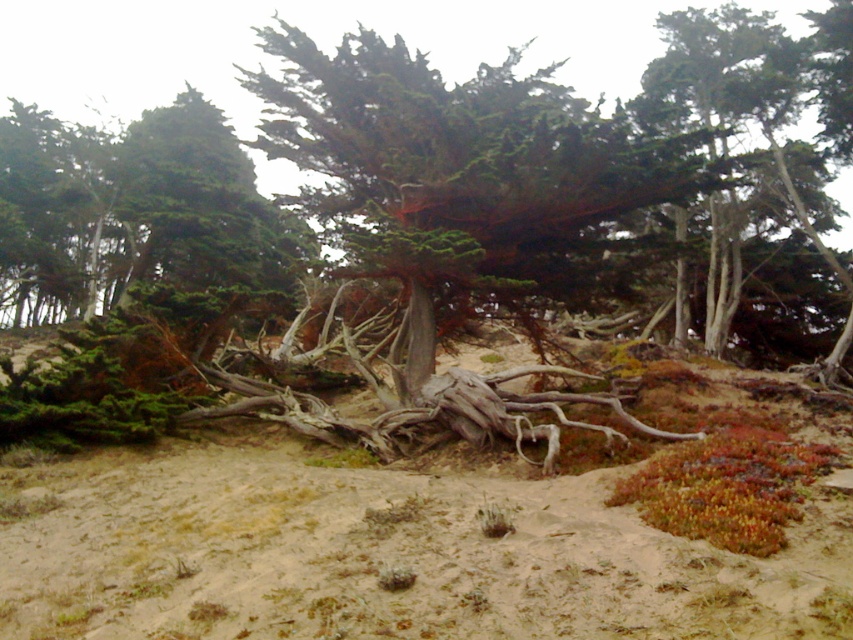
Who is shorter, brown textured sand at center or grayish-brown wood at center?

Standing shorter between the two is brown textured sand at center.

Based on the photo, is brown textured sand at center smaller than grayish-brown wood at center?

Indeed, brown textured sand at center has a smaller size compared to grayish-brown wood at center.

Is point (590, 588) positioned in front of point (601, 400)?

Yes, it is in front of point (601, 400).

Image resolution: width=853 pixels, height=640 pixels. I want to click on brown textured sand at center, so click(x=381, y=548).

This screenshot has height=640, width=853. What do you see at coordinates (381, 548) in the screenshot?
I see `brown textured sand at center` at bounding box center [381, 548].

The height and width of the screenshot is (640, 853). I want to click on brown textured sand at center, so click(381, 548).

At what (x,y) coordinates should I click in order to perform the action: click on brown textured sand at center. Please return your answer as a coordinate pair (x, y). Looking at the image, I should click on (381, 548).

Describe the element at coordinates (456, 170) in the screenshot. I see `green textured cypress tree at center` at that location.

Consider the image. Which is above, green textured cypress tree at center or grayish-brown wood at center?

Positioned higher is green textured cypress tree at center.

This screenshot has width=853, height=640. Describe the element at coordinates (456, 170) in the screenshot. I see `green textured cypress tree at center` at that location.

This screenshot has width=853, height=640. Find the location of `green textured cypress tree at center`. green textured cypress tree at center is located at coordinates (456, 170).